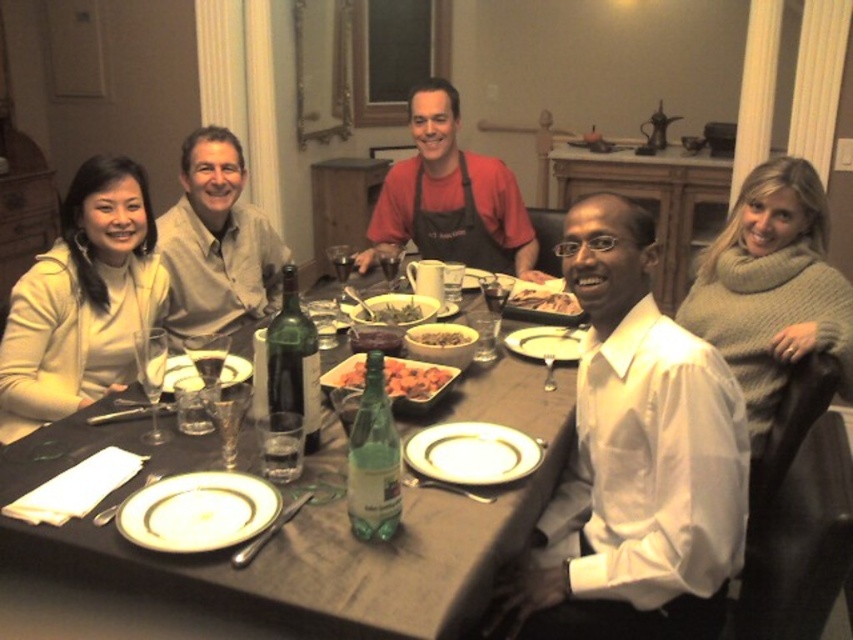
Question: Where is white glossy shirt at center located in relation to matte beige shirt at upper left in the image?

Choices:
 (A) left
 (B) right

Answer: (B)

Question: Considering the real-world distances, which object is closest to the green leafy vegetables at center?

Choices:
 (A) white matte sweater at lower left
 (B) matte beige shirt at upper left

Answer: (B)

Question: Can you confirm if red matte apron at center is positioned below brown matte rice bowl at center?

Choices:
 (A) no
 (B) yes

Answer: (A)

Question: Which point is closer to the camera?

Choices:
 (A) white porcelain plate at lower center
 (B) white porcelain plate at center
 (C) black matte table at center

Answer: (C)

Question: Which of the following is the closest to the observer?

Choices:
 (A) knitted beige sweater at right
 (B) green glass platter at center
 (C) white glossy shirt at center
 (D) white porcelain plate at lower left

Answer: (D)

Question: Is white glossy shirt at center to the left of white porcelain plate at lower left from the viewer's perspective?

Choices:
 (A) no
 (B) yes

Answer: (A)